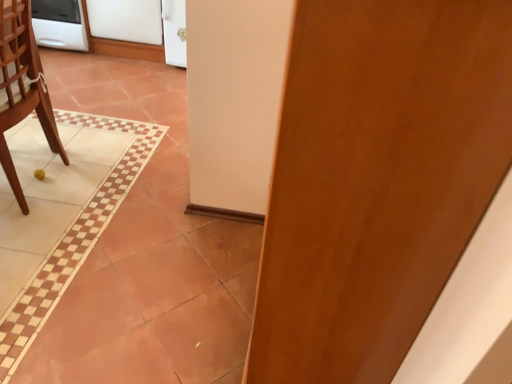
Question: In terms of height, does white matte refrigerator at upper left, which appears as the 1th screen door when viewed from the left, look taller or shorter compared to white glossy screen door at upper center, positioned as the second screen door in left-to-right order?

Choices:
 (A) short
 (B) tall

Answer: (A)

Question: In terms of size, does white matte refrigerator at upper left, which is the 2th screen door from right to left, appear bigger or smaller than white glossy screen door at upper center, positioned as the second screen door in left-to-right order?

Choices:
 (A) big
 (B) small

Answer: (A)

Question: Which of these objects is positioned closest to the white matte refrigerator at upper left, which is the 2th screen door from right to left?

Choices:
 (A) white glossy screen door at upper center, acting as the 1th screen door starting from the right
 (B) white glossy oven at upper left
 (C) wooden chair at left
 (D) wooden door at center

Answer: (A)

Question: Which object is positioned farthest from the white glossy screen door at upper center, acting as the 1th screen door starting from the right?

Choices:
 (A) white glossy oven at upper left
 (B) wooden door at center
 (C) white matte refrigerator at upper left, which is the 2th screen door from right to left
 (D) wooden chair at left

Answer: (B)